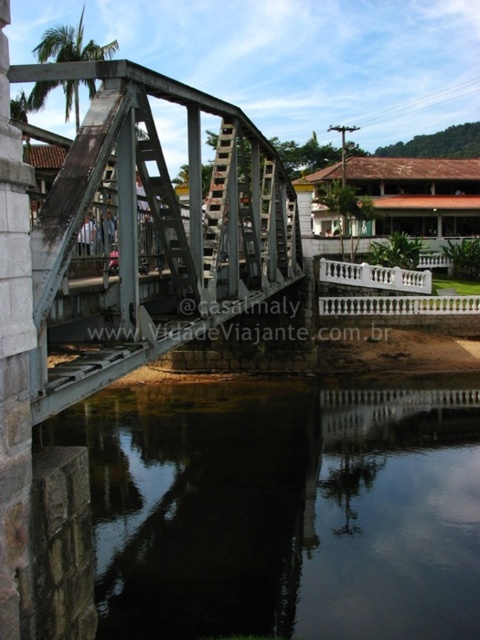
You are standing on the metallic gray bridge at center and want to see the black reflective water at lower center. Which direction should you look to see the water first?

Since the black reflective water at lower center is further to the viewer than the metallic gray bridge at center, you should look downward towards the water below the bridge to see it first.

You are standing on the metal truss bridge and looking down at the water. There is a point marked at coordinates (284, 508). What is located at this point?

The point at coordinates (284, 508) indicates black reflective water at lower center.